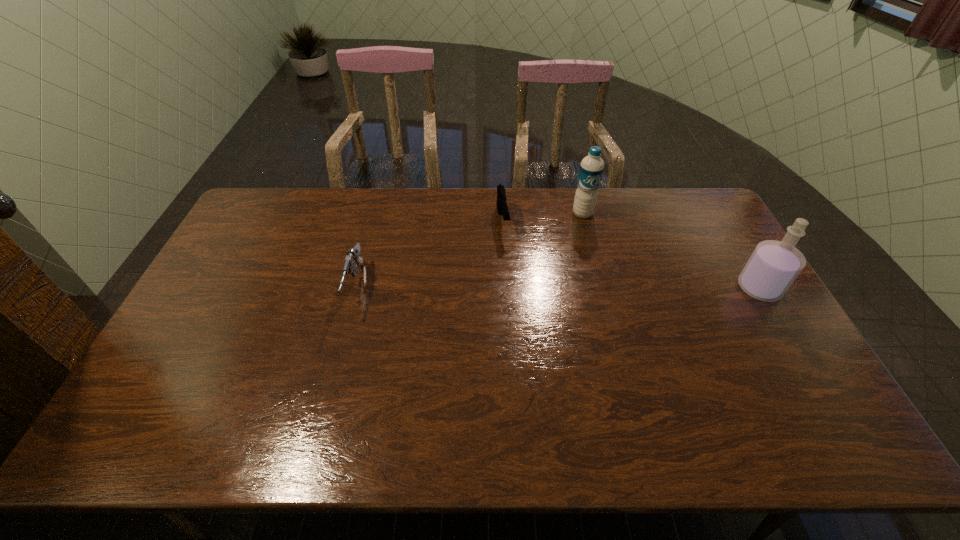
This screenshot has width=960, height=540. I want to click on object that is the third closest to the perfume, so click(x=353, y=258).

Identify which object is the closest to the gun. Please provide its 2D coordinates. Your answer should be formatted as a tuple, i.e. [(x, y)], where the tuple contains the x and y coordinates of a point satisfying the conditions above.

[(502, 208)]